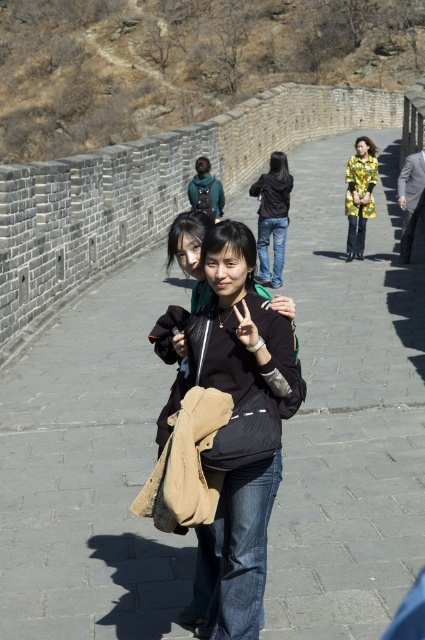
Question: Among these points, which one is nearest to the camera?

Choices:
 (A) (232, 534)
 (B) (363, 180)
 (C) (277, 244)

Answer: (A)

Question: Which object is positioned farthest from the yellow metallic jacket at center?

Choices:
 (A) black denim jeans at center
 (B) black matte jacket at center

Answer: (B)

Question: Considering the real-world distances, which object is closest to the black matte jacket at center?

Choices:
 (A) black denim jeans at center
 (B) yellow metallic jacket at center

Answer: (A)

Question: Does black matte jacket at center have a larger size compared to yellow metallic jacket at center?

Choices:
 (A) no
 (B) yes

Answer: (B)

Question: Is black matte jacket at center in front of black denim jeans at center?

Choices:
 (A) no
 (B) yes

Answer: (B)

Question: Can you confirm if black matte jacket at center is positioned to the right of yellow metallic jacket at center?

Choices:
 (A) yes
 (B) no

Answer: (B)